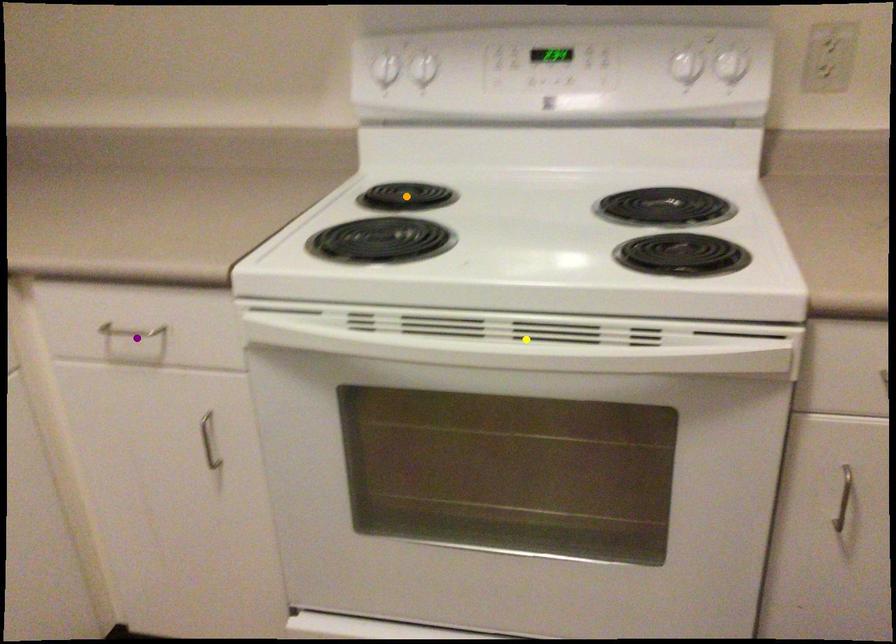
Order these from nearest to farthest:
yellow point
purple point
orange point

1. orange point
2. purple point
3. yellow point